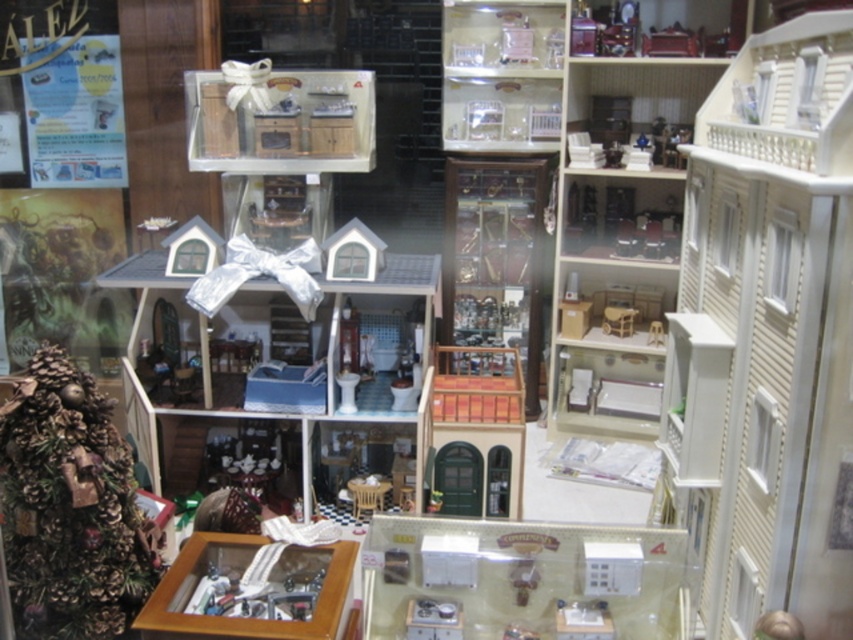
Question: Is green pinecone tree at left positioned at the back of wooden door at center?

Choices:
 (A) no
 (B) yes

Answer: (A)

Question: Among these points, which one is farthest from the camera?

Choices:
 (A) (445, 624)
 (B) (68, 592)
 (C) (485, 401)

Answer: (C)

Question: Which is nearer to the green pinecone tree at left?

Choices:
 (A) metallic silver scale at center
 (B) wooden door at center

Answer: (A)

Question: Which object appears closest to the camera in this image?

Choices:
 (A) metallic silver scale at center
 (B) green pinecone tree at left

Answer: (B)

Question: Can you confirm if wooden door at center is positioned to the right of metallic silver scale at center?

Choices:
 (A) yes
 (B) no

Answer: (A)

Question: Is wooden door at center above metallic silver scale at center?

Choices:
 (A) no
 (B) yes

Answer: (B)